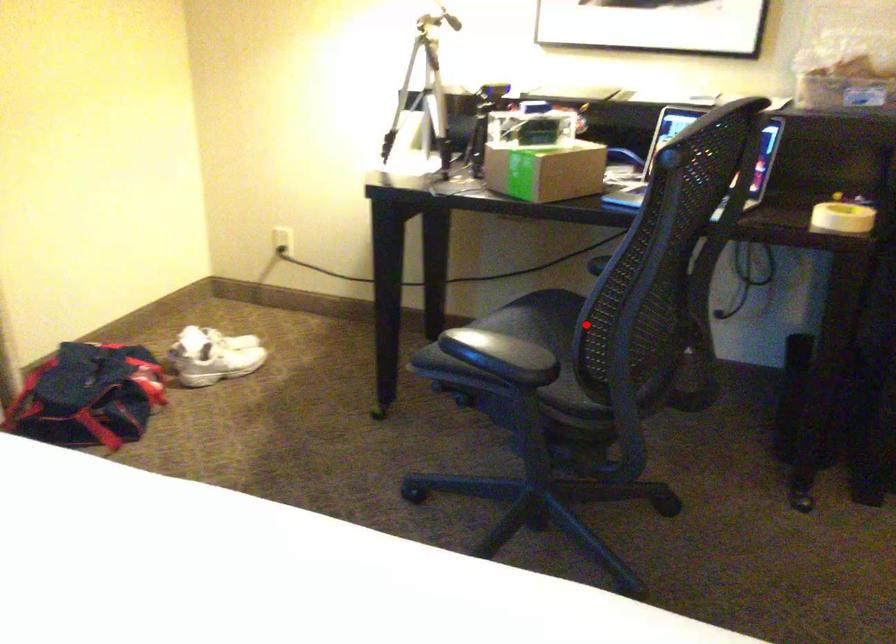
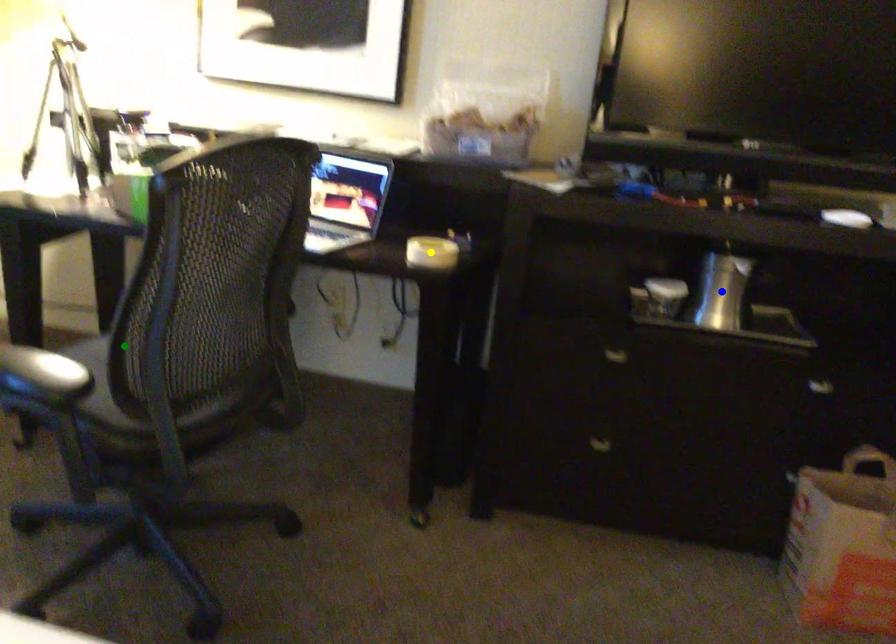
Question: I am providing you with two images of the same scene from different viewpoints. A red point is marked on the first image. You are given multiple points on the second image. Which mark in image 2 goes with the point in image 1?

Choices:
 (A) blue point
 (B) green point
 (C) yellow point

Answer: (B)